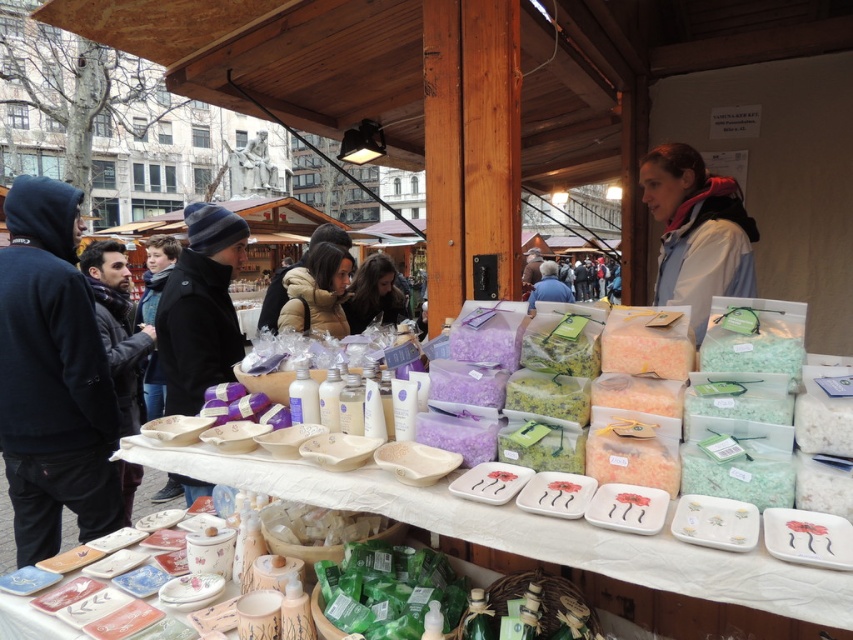
You are a customer at the market and want to buy a black knit hat at left and a matte black jacket at upper center. Which item has a smaller width when looking at them from the front?

The black knit hat at left is thinner than the matte black jacket at upper center, so the black knit hat at left has a smaller width when viewed from the front.

Based on the photo, you are standing at the market stall and want to know which of the two points, point [183,397] or point [564,289], is closer to you. Can you determine this based on the spatial arrangement?

Point [183,397] is closer to the viewer than point [564,289].

You are a customer at the market stall and want to reach for the gray fleece jacket at upper right. Given that the stall is 1.5 meters wide, can you estimate whether the jacket is positioned near the edge of the stall or closer to the center?

The gray fleece jacket at upper right is positioned at point (695, 232), which is closer to the edge of the stall since it is near the upper right corner. Therefore, the jacket is positioned near the edge of the stall.